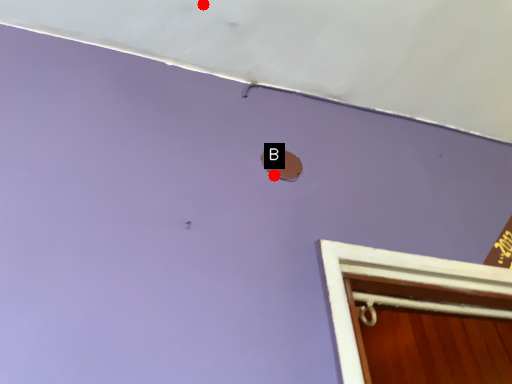
Question: Two points are circled on the image, labeled by A and B beside each circle. Which of the following is the closest to the observer?

Choices:
 (A) A is closer
 (B) B is closer

Answer: (B)